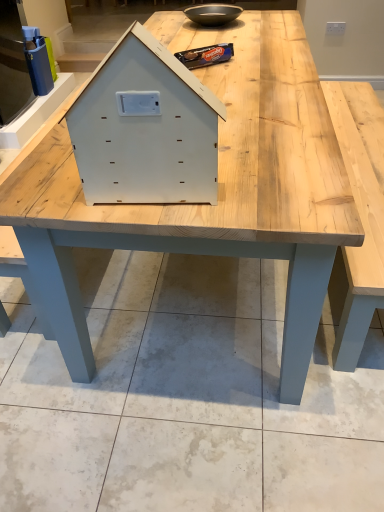
This screenshot has width=384, height=512. Describe the element at coordinates (145, 128) in the screenshot. I see `white matte wooden house at center` at that location.

At what (x,y) coordinates should I click in order to perform the action: click on matte black bowl at upper center. Please return your answer as a coordinate pair (x, y). The image size is (384, 512). Looking at the image, I should click on (213, 14).

What are the coordinates of `white matte wooden house at center` in the screenshot? It's located at [145, 128].

From the picture: Can you tell me how much white matte wooden house at center and light wood table at center differ in facing direction?

white matte wooden house at center and light wood table at center are facing 178 degrees away from each other.

Looking at this image, is white matte wooden house at center looking in the opposite direction of light wood table at center?

No, light wood table at center is not at the back of white matte wooden house at center.

Which is farther from the camera, [177,104] or [207,232]?

The point [207,232] is farther.

From the picture: Which of these two, light wood table at center or matte black bowl at upper center, is thinner?

With smaller width is matte black bowl at upper center.

The height and width of the screenshot is (512, 384). There is a light wood table at center. Identify the location of bowl above it (from a real-world perspective). (213, 14).

Considering the relative sizes of light wood table at center and matte black bowl at upper center in the image provided, is light wood table at center taller than matte black bowl at upper center?

Correct, light wood table at center is much taller as matte black bowl at upper center.

How many degrees apart are the facing directions of light wood table at center and white matte wooden house at center?

178 degrees.

From the image's perspective, which is below, light wood table at center or white matte wooden house at center?

From the image's view, white matte wooden house at center is below.

Is light wood table at center at the right side of white matte wooden house at center?

Indeed, light wood table at center is positioned on the right side of white matte wooden house at center.

In the scene shown: Is light wood table at center not within white matte wooden house at center?

light wood table at center is positioned outside white matte wooden house at center.

Do you think white matte wooden house at center is within matte black bowl at upper center, or outside of it?

The correct answer is: outside.

Who is bigger, white matte wooden house at center or matte black bowl at upper center?

Bigger between the two is white matte wooden house at center.

What's the angular difference between white matte wooden house at center and matte black bowl at upper center's facing directions?

179 degrees separate the facing orientations of white matte wooden house at center and matte black bowl at upper center.

Between matte black bowl at upper center and light wood table at center, which one has less height?

matte black bowl at upper center is shorter.

Would you consider matte black bowl at upper center to be distant from light wood table at center?

matte black bowl at upper center is near light wood table at center, not far away.

From a real-world perspective, which object stands above the other?

From a 3D spatial view, matte black bowl at upper center is above.

From their relative heights in the image, would you say matte black bowl at upper center is taller or shorter than white matte wooden house at center?

Clearly, matte black bowl at upper center is shorter compared to white matte wooden house at center.

Identify the location of bowl below the white matte wooden house at center (from a real-world perspective). This screenshot has height=512, width=384. (213, 14).

Is point (210, 24) farther from camera compared to point (177, 192)?

Yes, point (210, 24) is farther from viewer.

Is matte black bowl at upper center placed right next to white matte wooden house at center?

matte black bowl at upper center and white matte wooden house at center are clearly separated.

What are the coordinates of `drawer on the left of the light wood table at center` in the screenshot? It's located at (145, 128).

This screenshot has height=512, width=384. What are the coordinates of `table below the matte black bowl at upper center (from the image's perspective)` in the screenshot? It's located at (218, 190).

Which object lies further to the anchor point white matte wooden house at center, light wood table at center or matte black bowl at upper center?

Based on the image, matte black bowl at upper center appears to be further to white matte wooden house at center.

Looking at the image, which one is located closer to light wood table at center, white matte wooden house at center or matte black bowl at upper center?

white matte wooden house at center is closer to light wood table at center.

Looking at the image, which one is located further to matte black bowl at upper center, white matte wooden house at center or light wood table at center?

white matte wooden house at center is further to matte black bowl at upper center.

Which object lies nearer to the anchor point matte black bowl at upper center, light wood table at center or white matte wooden house at center?

light wood table at center is closer to matte black bowl at upper center.

Estimate the real-world distances between objects in this image. Which object is closer to light wood table at center, matte black bowl at upper center or white matte wooden house at center?

white matte wooden house at center is positioned closer to the anchor light wood table at center.

Looking at this image, looking at the image, which one is located further to white matte wooden house at center, matte black bowl at upper center or light wood table at center?

matte black bowl at upper center is positioned further to the anchor white matte wooden house at center.

Locate an element on the screen. The width and height of the screenshot is (384, 512). table between white matte wooden house at center and matte black bowl at upper center in the front-back direction is located at coordinates (218, 190).